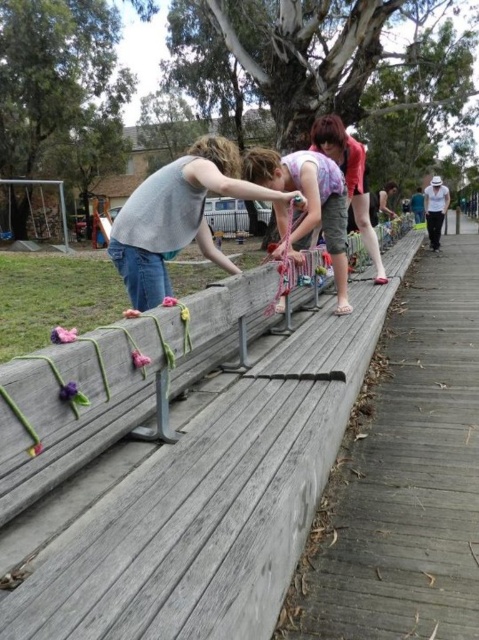
Can you confirm if pastel floral dress at center is wider than light pink fabric at center?

No, pastel floral dress at center is not wider than light pink fabric at center.

In the scene shown: Does pastel floral dress at center have a lesser width compared to light pink fabric at center?

Yes, pastel floral dress at center is thinner than light pink fabric at center.

Is point (286, 212) positioned in front of point (330, 156)?

Yes, point (286, 212) is in front of point (330, 156).

The height and width of the screenshot is (640, 479). Find the location of `pastel floral dress at center`. pastel floral dress at center is located at coordinates (308, 202).

In the scene shown: Who is more distant from viewer, (287, 195) or (375, 246)?

The point (375, 246) is behind.

Is matte gray tank top at center wider than light pink fabric at center?

Yes, matte gray tank top at center is wider than light pink fabric at center.

Locate an element on the screen. matte gray tank top at center is located at coordinates (178, 216).

Does matte gray tank top at center appear over pastel floral dress at center?

Yes.

The width and height of the screenshot is (479, 640). In order to click on matte gray tank top at center in this screenshot , I will do `click(178, 216)`.

The image size is (479, 640). Find the location of `matte gray tank top at center`. matte gray tank top at center is located at coordinates (178, 216).